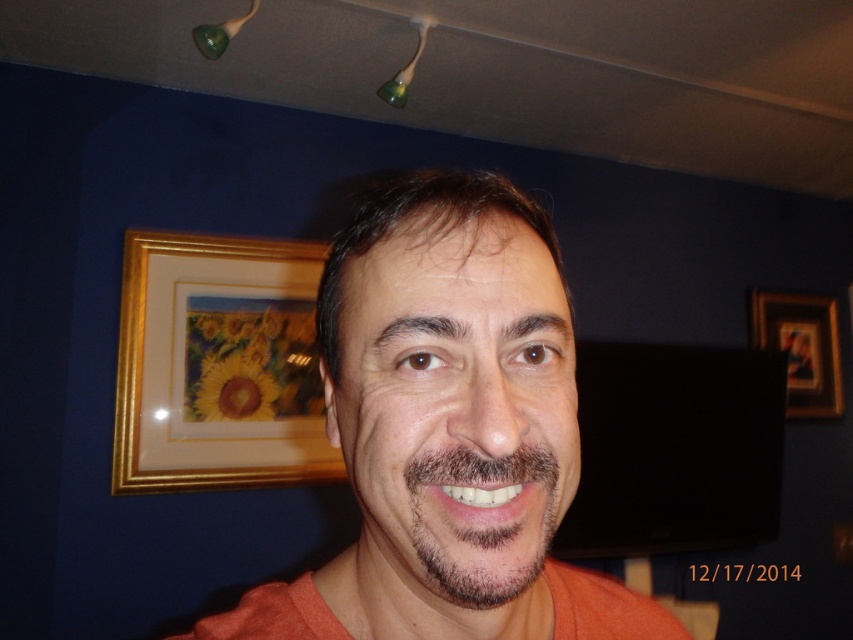
Question: Which is nearer to the dark brown stubble at center?

Choices:
 (A) orange matte shirt at center
 (B) gold framed picture at upper left
 (C) smooth skin face at center
 (D) gold-framed picture at upper right

Answer: (C)

Question: Can you confirm if smooth skin face at center is positioned above gold-framed picture at upper right?

Choices:
 (A) no
 (B) yes

Answer: (A)

Question: Does smooth skin face at center appear under gold framed picture at upper left?

Choices:
 (A) no
 (B) yes

Answer: (A)

Question: Based on their relative distances, which object is nearer to the gold framed picture at upper left?

Choices:
 (A) gold-framed picture at upper right
 (B) smooth skin face at center
 (C) orange matte shirt at center

Answer: (C)

Question: Which point is farther from the camera taking this photo?

Choices:
 (A) (241, 392)
 (B) (343, 563)

Answer: (A)

Question: Does smooth skin face at center have a smaller size compared to gold-framed picture at upper right?

Choices:
 (A) yes
 (B) no

Answer: (A)